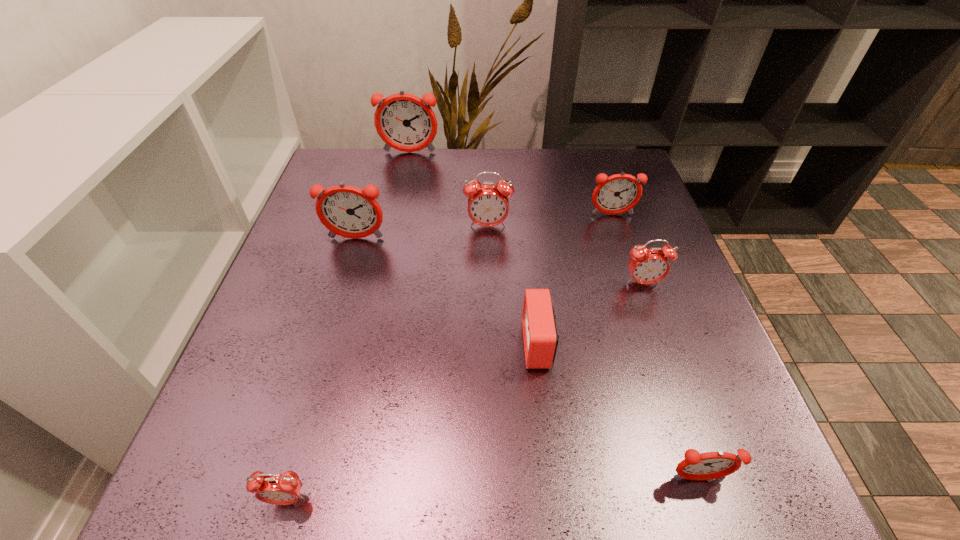
Where is `vacant area that lies between the seventh nearest object and the fourth farthest alarm clock`? This screenshot has width=960, height=540. vacant area that lies between the seventh nearest object and the fourth farthest alarm clock is located at coordinates (484, 227).

In order to click on free point between the third farthest reddish-pink alarm clock and the farthest red alarm clock in this screenshot , I will do `click(422, 233)`.

Identify the location of vacant region between the second nearest red alarm clock and the fourth nearest alarm clock. (590, 314).

Choose which object is the nearest neighbor to the leftmost red alarm clock. Please provide its 2D coordinates. Your answer should be formatted as a tuple, i.e. [(x, y)], where the tuple contains the x and y coordinates of a point satisfying the conditions above.

[(540, 336)]

Find the location of `object that ranks as the third closest to the fourth object from right to left`. object that ranks as the third closest to the fourth object from right to left is located at coordinates (488, 205).

Locate which alarm clock is the fourth closest to the nearest red alarm clock. Please provide its 2D coordinates. Your answer should be formatted as a tuple, i.e. [(x, y)], where the tuple contains the x and y coordinates of a point satisfying the conditions above.

[(488, 205)]

Image resolution: width=960 pixels, height=540 pixels. What are the coordinates of `the seventh closest alarm clock relative to the fourth nearest object` in the screenshot? It's located at (280, 489).

Identify which reddish-pink alarm clock is the fourth closest to the nearest alarm clock. Please provide its 2D coordinates. Your answer should be formatted as a tuple, i.e. [(x, y)], where the tuple contains the x and y coordinates of a point satisfying the conditions above.

[(405, 122)]

The image size is (960, 540). What are the coordinates of `reddish-pink alarm clock that is the third closest to the nearest reddish-pink alarm clock` in the screenshot? It's located at (405, 122).

At what (x,y) coordinates should I click in order to perform the action: click on red alarm clock object that ranks as the closest to the rightmost red alarm clock. Please return your answer as a coordinate pair (x, y). This screenshot has width=960, height=540. Looking at the image, I should click on pos(540,336).